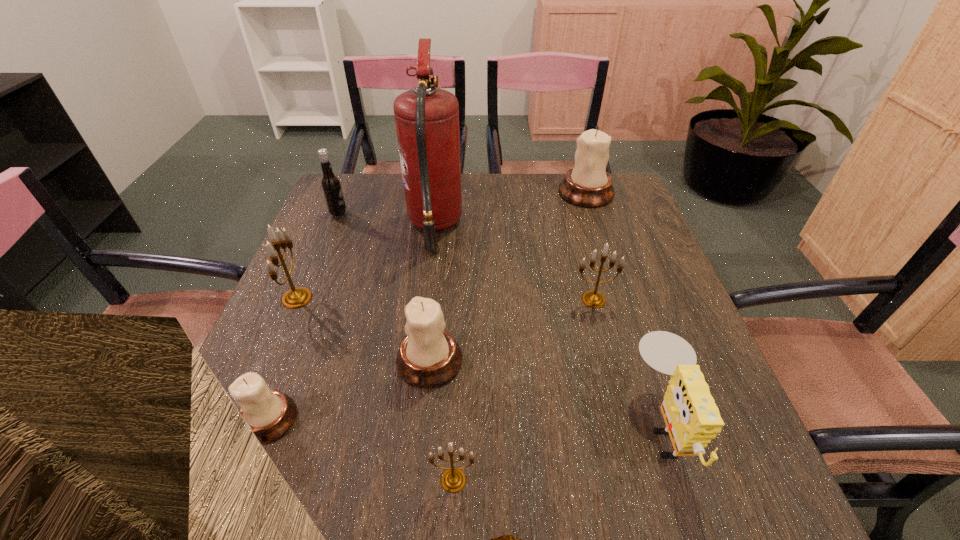
Image resolution: width=960 pixels, height=540 pixels. What are the coordinates of `root beer situated at the left edge` in the screenshot? It's located at (330, 183).

Where is `sponge at the right edge`? This screenshot has height=540, width=960. sponge at the right edge is located at coordinates click(692, 418).

Locate an element on the screen. Image resolution: width=960 pixels, height=540 pixels. object at the far left corner is located at coordinates (330, 183).

The image size is (960, 540). In order to click on object that is at the far right corner in this screenshot , I will do `click(588, 184)`.

This screenshot has height=540, width=960. I want to click on object positioned at the near right corner, so click(692, 418).

At what (x,y) coordinates should I click in order to perform the action: click on free space at the far edge of the desktop. Please return your answer as a coordinate pair (x, y). This screenshot has height=540, width=960. Looking at the image, I should click on (392, 183).

This screenshot has width=960, height=540. What are the coordinates of `vacant region at the left edge of the desktop` in the screenshot? It's located at (307, 349).

The width and height of the screenshot is (960, 540). In the image, there is a desktop. In order to click on free space at the right edge in this screenshot , I will do `click(647, 242)`.

Image resolution: width=960 pixels, height=540 pixels. I want to click on free space at the far left corner of the desktop, so click(x=347, y=176).

Where is `free space between the nearest white candle holder and the second biggest white candle holder`? free space between the nearest white candle holder and the second biggest white candle holder is located at coordinates (349, 390).